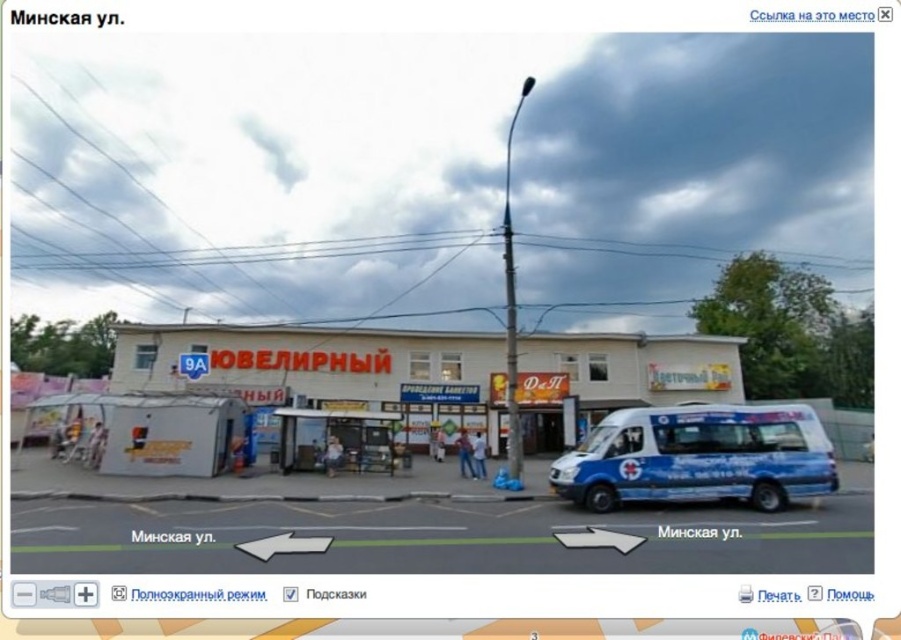
Question: Does white matte building at center appear on the right side of blue metallic van at right?

Choices:
 (A) yes
 (B) no

Answer: (B)

Question: From the image, what is the correct spatial relationship of white matte building at center in relation to blue metallic van at right?

Choices:
 (A) right
 (B) left

Answer: (B)

Question: Based on their relative distances, which object is nearer to the blue metallic van at right?

Choices:
 (A) blue metallic van at center
 (B) white matte building at center

Answer: (A)

Question: Which of the following is the closest to the observer?

Choices:
 (A) white matte building at center
 (B) blue metallic van at center

Answer: (B)

Question: Considering the real-world distances, which object is closest to the blue metallic van at right?

Choices:
 (A) white matte building at center
 (B) blue metallic van at center

Answer: (B)

Question: Is white matte building at center to the right of blue metallic van at center from the viewer's perspective?

Choices:
 (A) yes
 (B) no

Answer: (B)